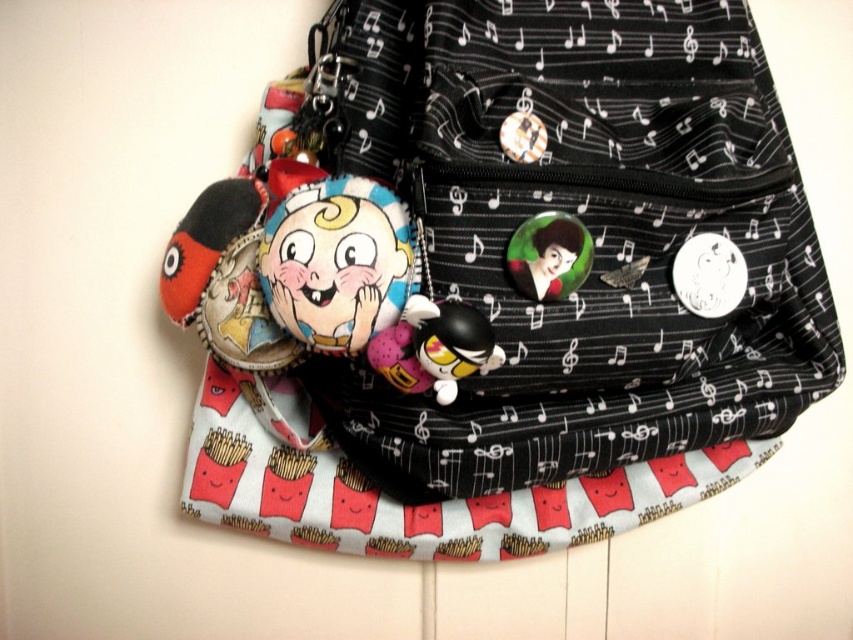
Is point (299, 212) positioned before point (531, 221)?

Yes, it is.

Does soft plush toy at center appear under shiny metallic button at center?

Yes.

This screenshot has width=853, height=640. Describe the element at coordinates (337, 262) in the screenshot. I see `soft plush toy at center` at that location.

What are the coordinates of `soft plush toy at center` in the screenshot? It's located at (337, 262).

Describe the element at coordinates (512, 234) in the screenshot. I see `black fabric backpack at center` at that location.

You are a GUI agent. You are given a task and a screenshot of the screen. Output one action in this format:
    pyautogui.click(x=<x>, y=<y>)
    Task: Click on the black fabric backpack at center
    The height and width of the screenshot is (640, 853).
    Given the screenshot: What is the action you would take?
    pyautogui.click(x=512, y=234)

Is point (784, 129) farther from camera compared to point (558, 272)?

Yes, it is.

This screenshot has height=640, width=853. In order to click on black fabric backpack at center in this screenshot , I will do `click(512, 234)`.

Identify the location of black fabric backpack at center. (512, 234).

Locate an element on the screen. This screenshot has width=853, height=640. black fabric backpack at center is located at coordinates pos(512,234).